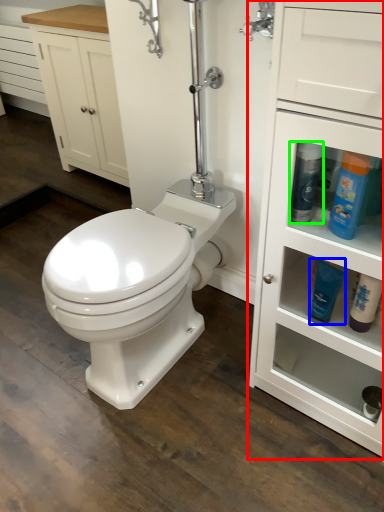
Question: Which object is positioned closest to bathroom cabinet (highlighted by a red box)? Select from cleaning product (highlighted by a blue box) and cleaning product (highlighted by a green box).

Choices:
 (A) cleaning product
 (B) cleaning product

Answer: (A)